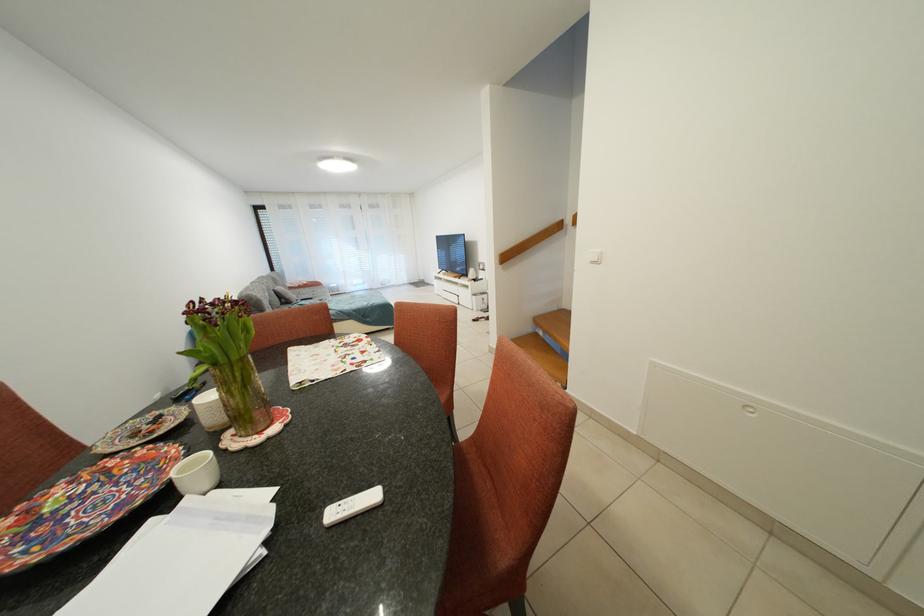
Describe the element at coordinates (594, 256) in the screenshot. I see `the white light switch` at that location.